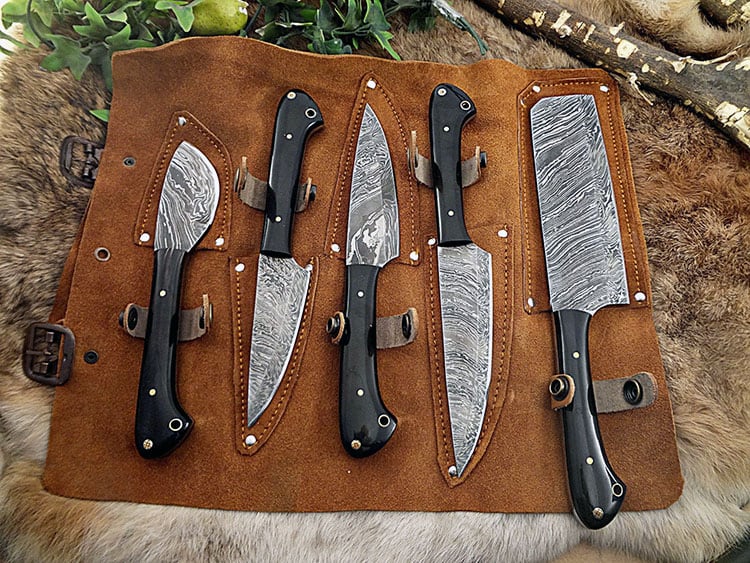
Find the location of a particular element. The image size is (750, 563). pegs in knife handle is located at coordinates (165, 294), (151, 388), (291, 136), (276, 220), (361, 294), (361, 394), (448, 129), (451, 212), (577, 355), (592, 457).